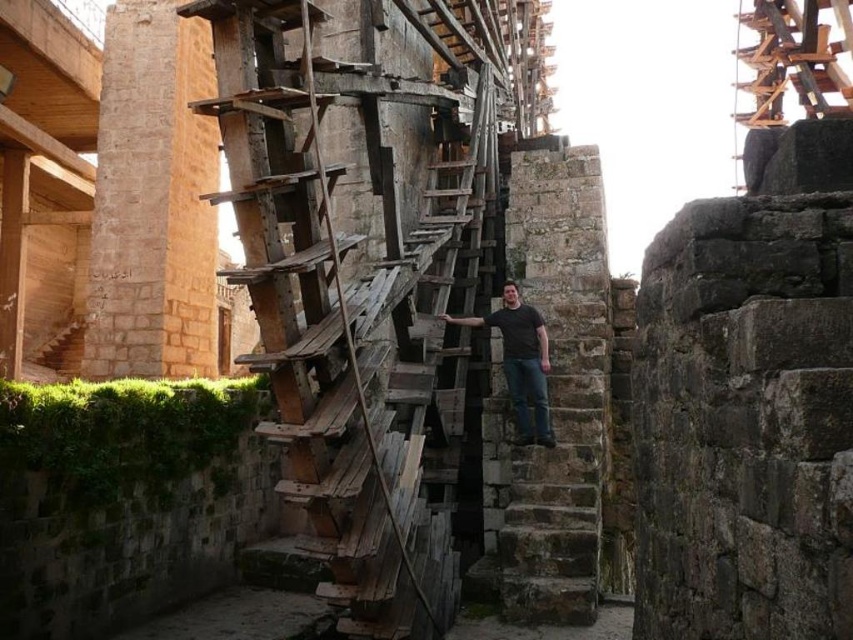
You are navigating through the ancient site and want to reach the wooden structure. You are currently standing at point (454, 17) and need to get to point (515, 346). Which direction should you move to get closer to your destination?

To move from point (454, 17) to point (515, 346), you should move towards the right and slightly upwards since point (515, 346) is located to the right and slightly above point (454, 17).